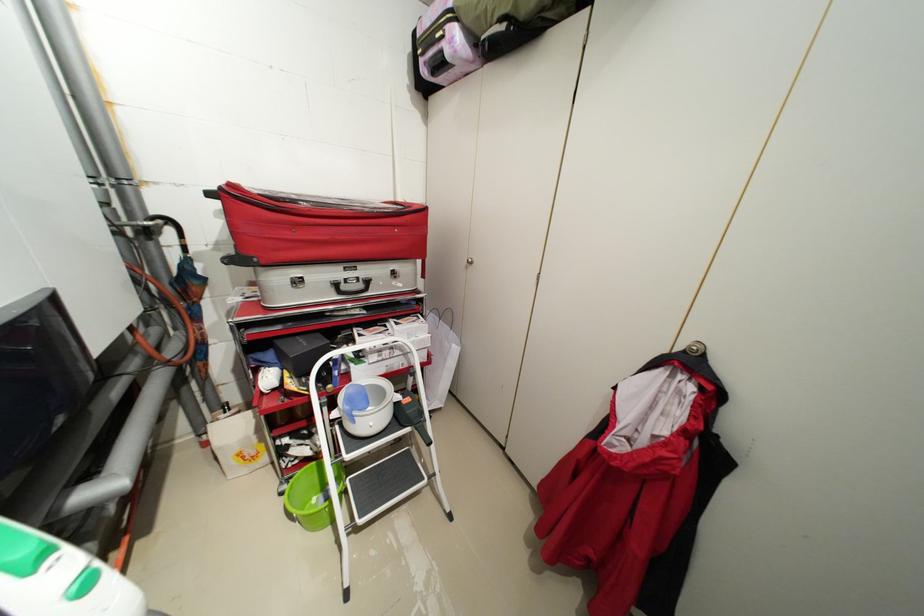
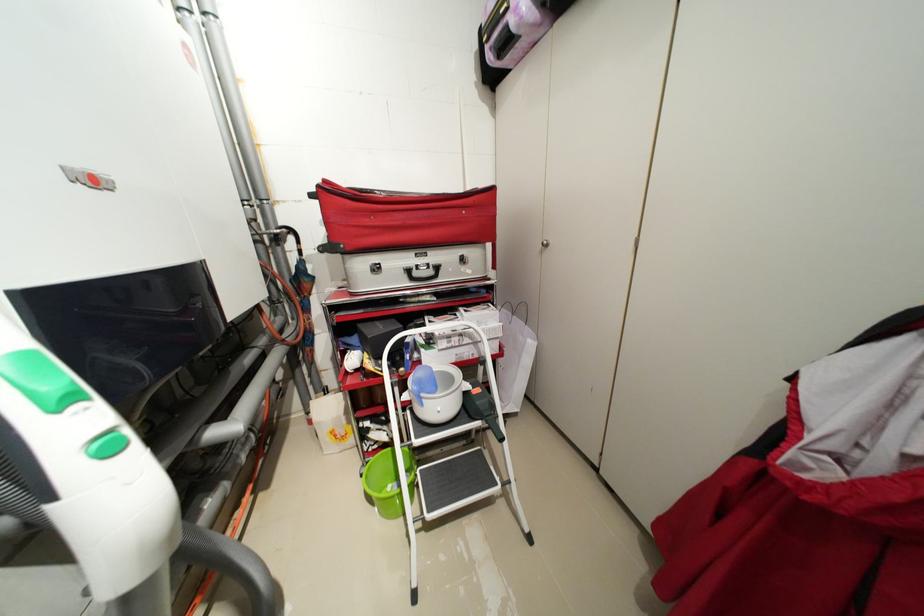
In the second image, find the point that corresponds to [296,498] in the first image.

(373, 479)